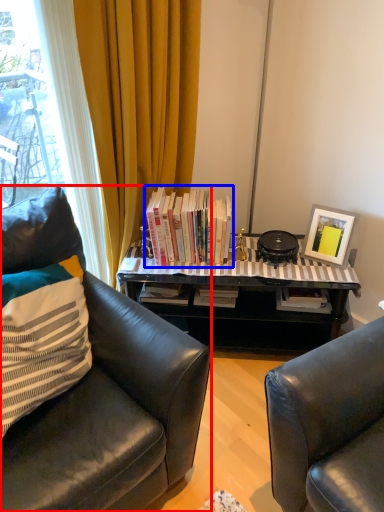
Question: Which object is further to the camera taking this photo, chair (highlighted by a red box) or book (highlighted by a blue box)?

Choices:
 (A) chair
 (B) book

Answer: (B)